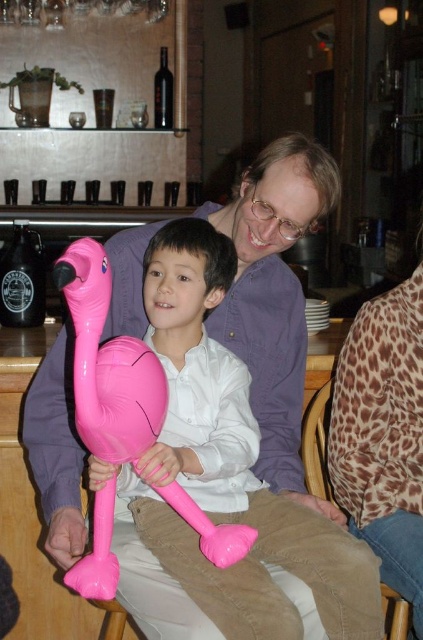
You are an interior designer assessing the decor of this bar or cafe. You notice two leopard print items in the scene. Which one, the leopard print blouse at upper right or the leopard print fabric at lower right, is taller?

The leopard print blouse at upper right is taller than the leopard print fabric at lower right.

You are standing in the bar and need to locate the man wearing the matte purple shirt at center. According to the coordinates provided, where would you find him in the image?

The matte purple shirt at center is located at coordinates point 0.464 on the x axis and 0.650 on the y axis.

You are a photographer setting up for a family portrait in the scene described. You need to ensure that the matte purple shirt at center and the leopard print fabric at lower right are both visible in the frame. Based on their positions, which object should you focus on first to ensure both are in the shot?

The matte purple shirt at center is located above the leopard print fabric at lower right. To ensure both are in the frame, focus on the matte purple shirt at center first as it is higher up, allowing the lower leopard print fabric to naturally fall into the shot below.